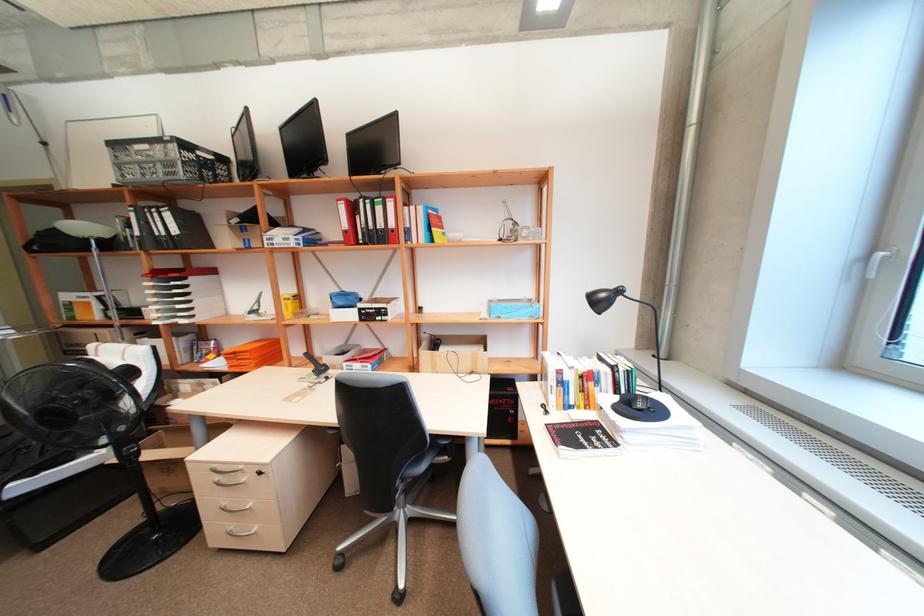
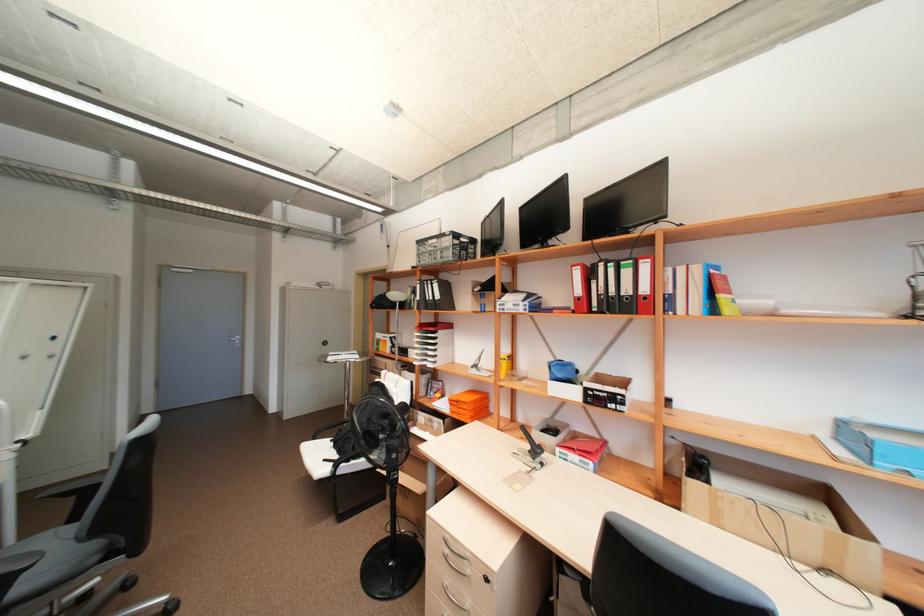
The point at (384, 209) is marked in the first image. Where is the corresponding point in the second image?

(633, 273)